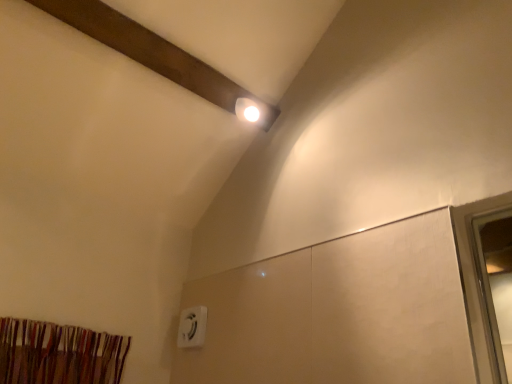
Question: Can you confirm if striped fabric curtain at lower left is smaller than white plastic electric outlet at lower center?

Choices:
 (A) no
 (B) yes

Answer: (A)

Question: Considering the relative sizes of striped fabric curtain at lower left and white plastic electric outlet at lower center in the image provided, is striped fabric curtain at lower left wider than white plastic electric outlet at lower center?

Choices:
 (A) yes
 (B) no

Answer: (A)

Question: Does striped fabric curtain at lower left have a greater height compared to white plastic electric outlet at lower center?

Choices:
 (A) yes
 (B) no

Answer: (B)

Question: Does striped fabric curtain at lower left turn towards white plastic electric outlet at lower center?

Choices:
 (A) no
 (B) yes

Answer: (A)

Question: From the image's perspective, would you say striped fabric curtain at lower left is positioned over white plastic electric outlet at lower center?

Choices:
 (A) yes
 (B) no

Answer: (A)

Question: Is striped fabric curtain at lower left placed right next to white plastic electric outlet at lower center?

Choices:
 (A) yes
 (B) no

Answer: (B)

Question: Is white plastic electric outlet at lower center at the right side of striped fabric curtain at lower left?

Choices:
 (A) no
 (B) yes

Answer: (B)

Question: Is white plastic electric outlet at lower center oriented towards striped fabric curtain at lower left?

Choices:
 (A) no
 (B) yes

Answer: (B)

Question: From a real-world perspective, is white plastic electric outlet at lower center physically above striped fabric curtain at lower left?

Choices:
 (A) no
 (B) yes

Answer: (B)

Question: From the image's perspective, is white plastic electric outlet at lower center on striped fabric curtain at lower left?

Choices:
 (A) yes
 (B) no

Answer: (B)

Question: Is white plastic electric outlet at lower center beside striped fabric curtain at lower left?

Choices:
 (A) no
 (B) yes

Answer: (A)

Question: Considering the relative positions of white plastic electric outlet at lower center and striped fabric curtain at lower left in the image provided, is white plastic electric outlet at lower center in front of striped fabric curtain at lower left?

Choices:
 (A) yes
 (B) no

Answer: (B)

Question: From their relative heights in the image, would you say white plastic electric outlet at lower center is taller or shorter than striped fabric curtain at lower left?

Choices:
 (A) short
 (B) tall

Answer: (B)